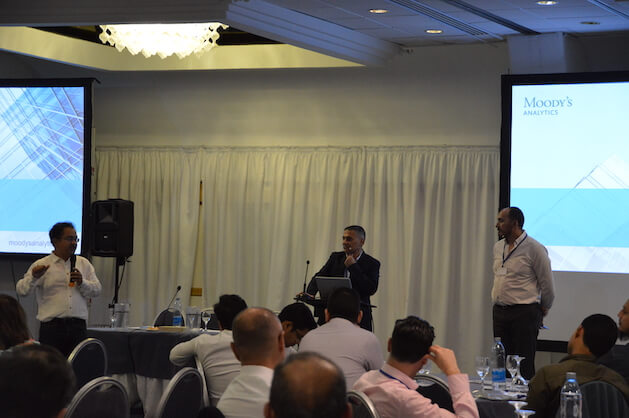
Locate an element on the screen. curtain is located at coordinates (268, 144).